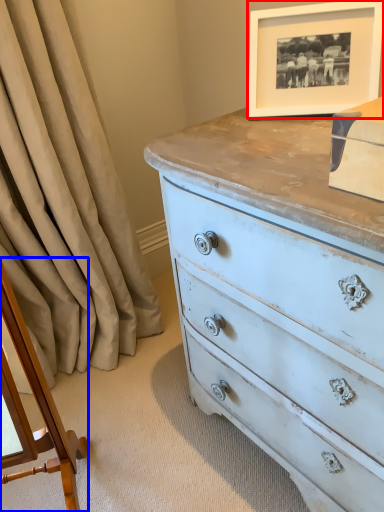
Question: Which of the following is the closest to the observer, picture frame (highlighted by a red box) or changing table (highlighted by a blue box)?

Choices:
 (A) picture frame
 (B) changing table

Answer: (B)